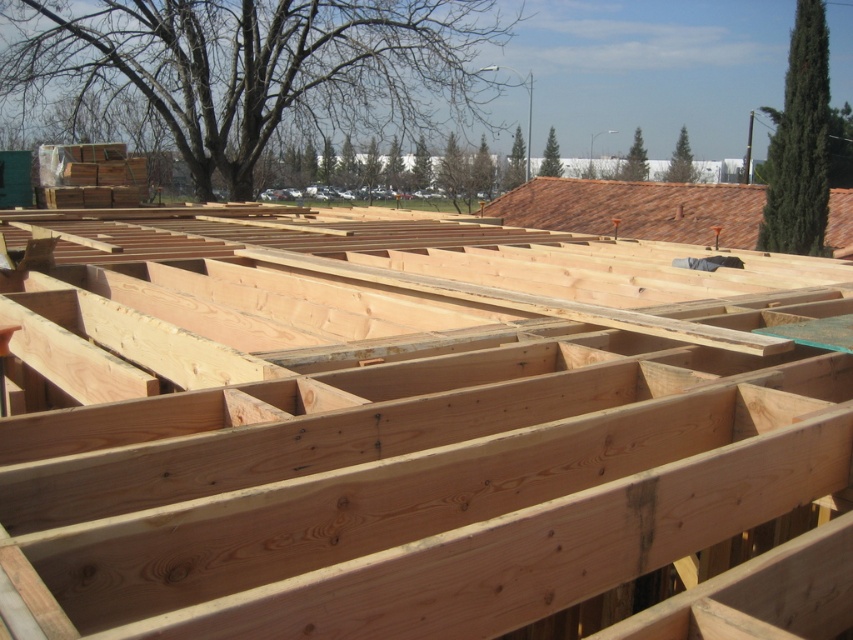
You are standing at the origin point in the image. Which direction should you move to reach the natural wood beams at center?

The natural wood beams at center are located at coordinates point (421, 436), so you should move towards the right and slightly upwards from the origin point to reach them.

You are an architect examining the construction site. You notice the natural wood beams at center and the brown tile roof at upper right. Which object is positioned to the left of the other?

The natural wood beams at center are positioned to the left of the brown tile roof at upper right.